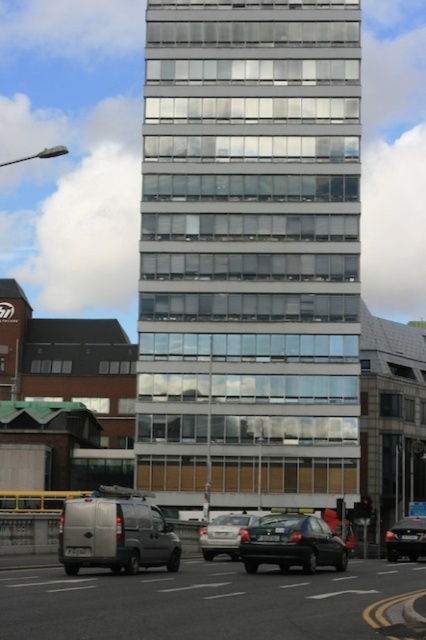
Question: Which object is farther from the camera taking this photo?

Choices:
 (A) shiny black sedan at center
 (B) clear glass building at center
 (C) shiny black sedan at lower right
 (D) silver metallic van at lower left

Answer: (B)

Question: Does shiny black sedan at center appear on the left side of shiny black sedan at lower right?

Choices:
 (A) yes
 (B) no

Answer: (A)

Question: Is clear glass building at center behind silver metallic sedan at center?

Choices:
 (A) no
 (B) yes

Answer: (B)

Question: Where is silver metallic sedan at center located in relation to shiny black sedan at lower right in the image?

Choices:
 (A) below
 (B) above

Answer: (A)

Question: Which of the following is the closest to the observer?

Choices:
 (A) (233, 531)
 (B) (290, 561)

Answer: (B)

Question: Which object appears closest to the camera in this image?

Choices:
 (A) silver metallic sedan at center
 (B) silver metallic van at lower left
 (C) shiny black sedan at center

Answer: (B)